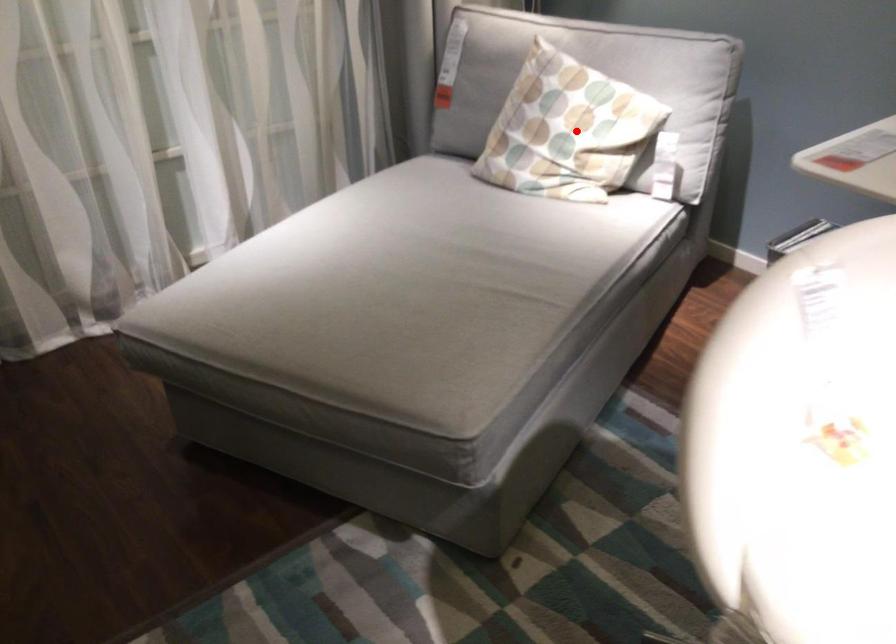
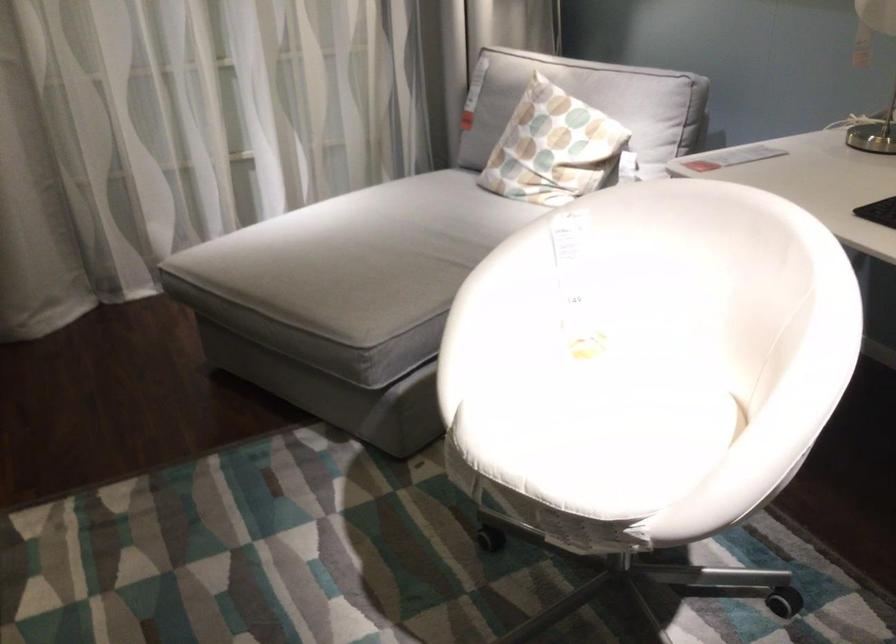
Question: I am providing you with two images of the same scene from different viewpoints. Given a red point in image1, look at the same physical point in image2. Is it:

Choices:
 (A) Closer to the viewpoint
 (B) Farther from the viewpoint

Answer: (B)